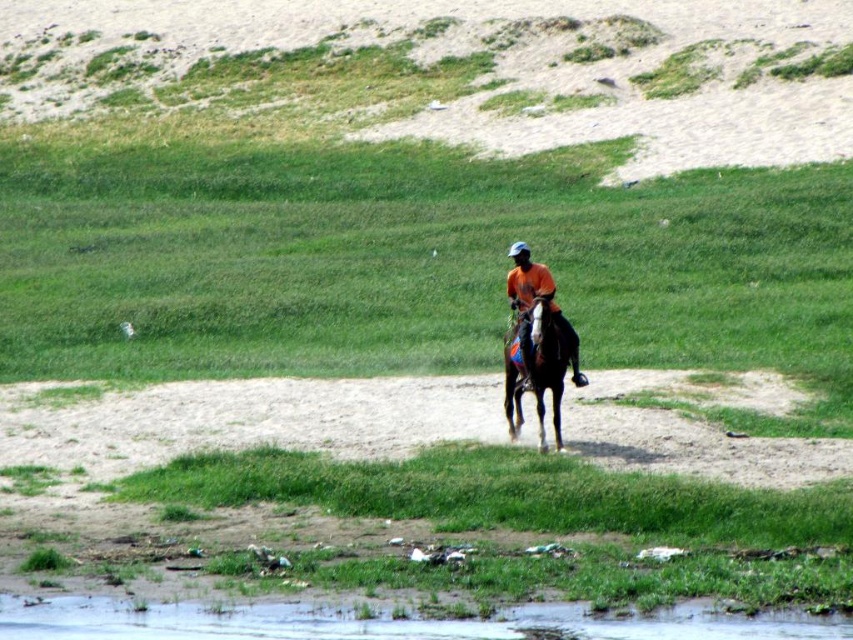
Question: Which of the following is the farthest from the observer?

Choices:
 (A) shiny brown horse at center
 (B) orange cotton shirt at center

Answer: (B)

Question: Can you confirm if green grassy field at center is bigger than orange cotton shirt at center?

Choices:
 (A) no
 (B) yes

Answer: (B)

Question: Can you confirm if green grassy field at center is wider than brown sandy ground at lower center?

Choices:
 (A) yes
 (B) no

Answer: (A)

Question: Which object appears farthest from the camera in this image?

Choices:
 (A) green grassy field at center
 (B) shiny brown horse at center
 (C) brown sandy ground at lower center
 (D) orange cotton shirt at center

Answer: (A)

Question: Does green grassy field at center appear over orange cotton shirt at center?

Choices:
 (A) yes
 (B) no

Answer: (A)

Question: Which object is closer to the camera taking this photo?

Choices:
 (A) brown sandy ground at lower center
 (B) green grassy field at center

Answer: (A)